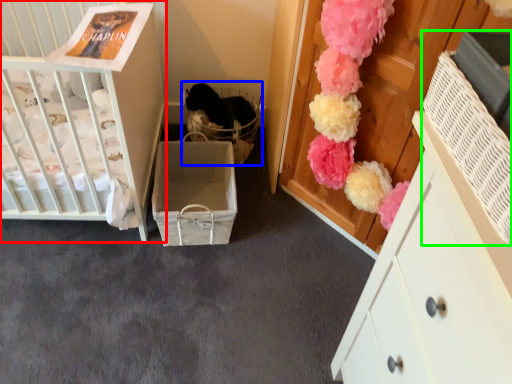
Question: Which object is the farthest from infant bed (highlighted by a red box)? Choose among these: baby carriage (highlighted by a blue box) or storage box (highlighted by a green box).

Choices:
 (A) baby carriage
 (B) storage box

Answer: (B)